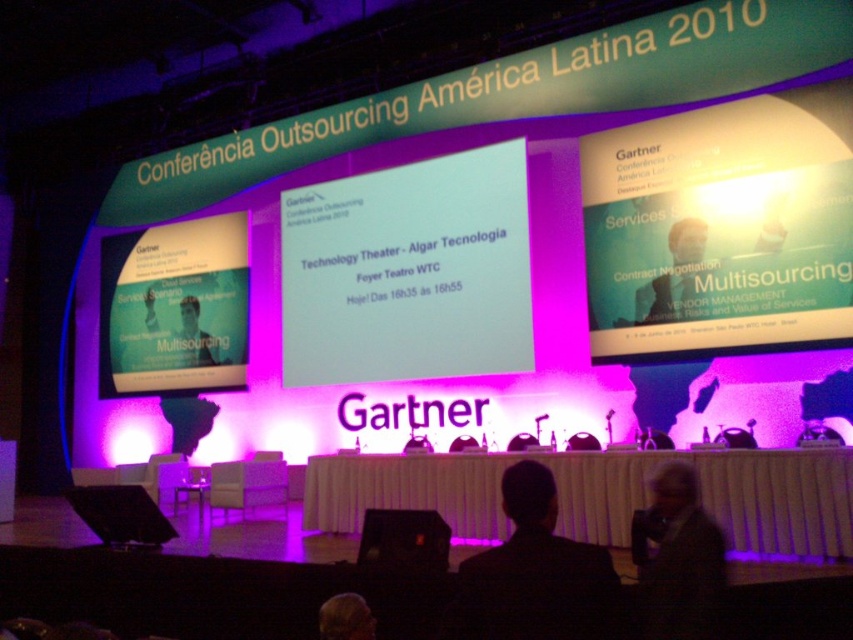
Question: Which point is farther to the camera?

Choices:
 (A) (659, 550)
 (B) (486, 253)

Answer: (B)

Question: Can you confirm if white glossy projector screen at center is positioned to the left of smooth plastic person at center?

Choices:
 (A) yes
 (B) no

Answer: (A)

Question: Is white glossy projector screen at center wider than gray fabric at lower right?

Choices:
 (A) no
 (B) yes

Answer: (B)

Question: Which object is the farthest from the matte white projector screen at upper right?

Choices:
 (A) dark brown hair at center
 (B) white glossy projector screen at center
 (C) smooth plastic person at center

Answer: (A)

Question: Which point is farther to the camera?

Choices:
 (A) dark brown hair at center
 (B) smooth plastic person at center
 (C) black suit at center
 (D) white paper at center

Answer: (D)

Question: Is white glossy projector screen at center behind matte white text at center?

Choices:
 (A) no
 (B) yes

Answer: (A)